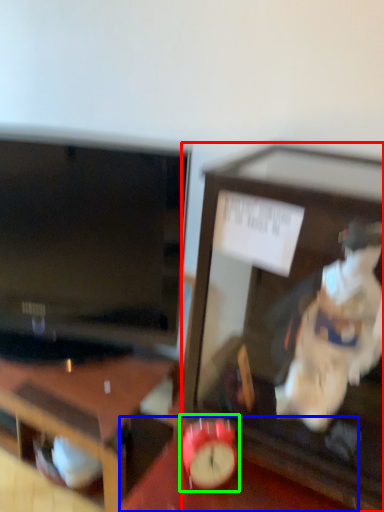
Question: Which object is positioned farthest from furniture (highlighted by a red box)? Select from table (highlighted by a blue box) and alarm clock (highlighted by a green box).

Choices:
 (A) table
 (B) alarm clock

Answer: (B)